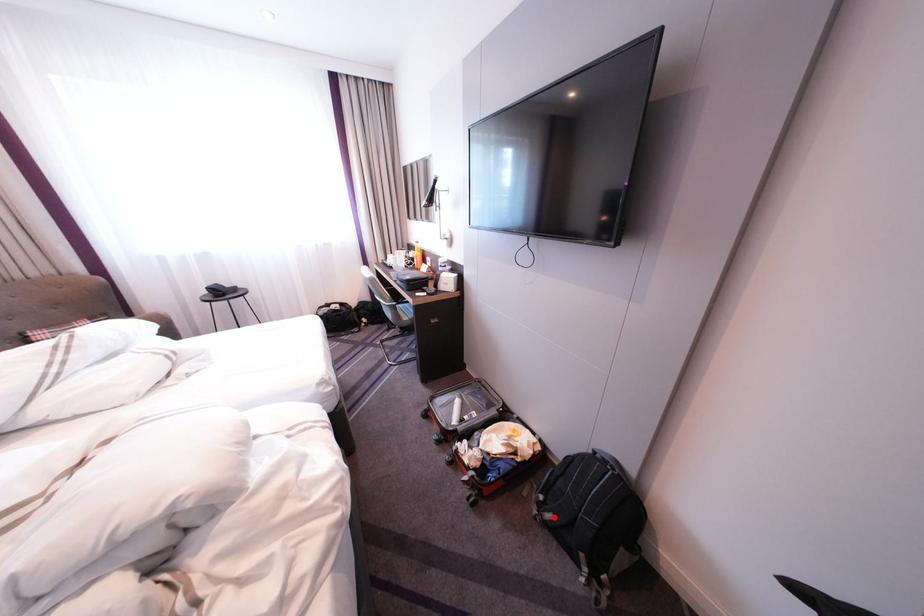
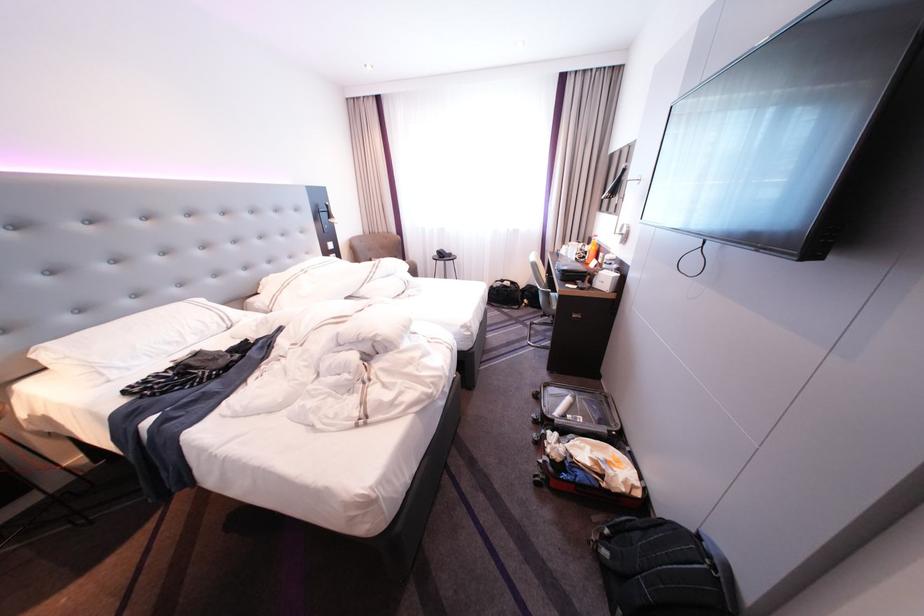
Locate, in the second image, the point that corresponds to the highlighted location in the first image.

(610, 548)